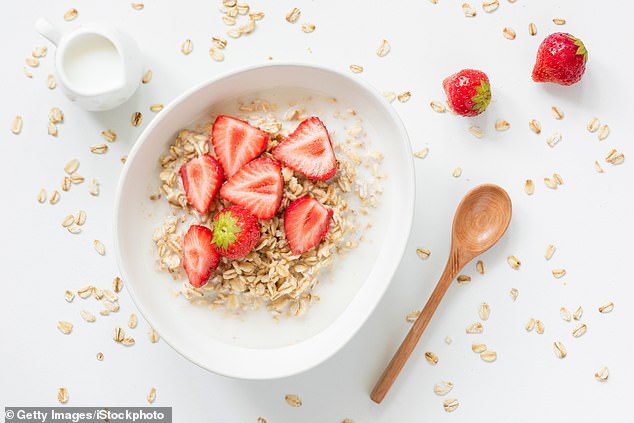
Locate an element on the screen. spoon handle is located at coordinates (406, 342).